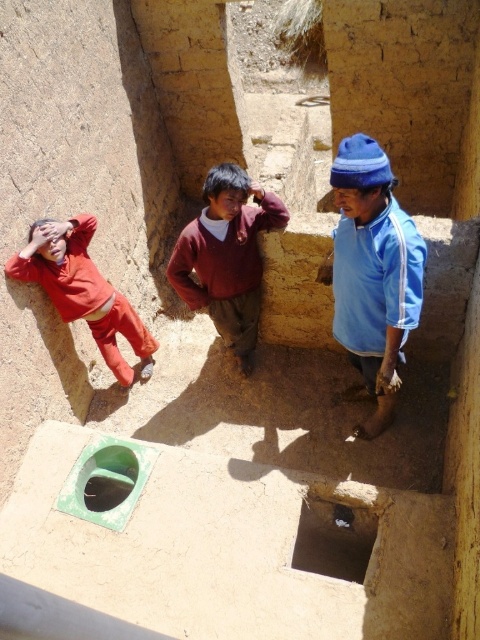
You are standing in a rustic bathroom with three people. You need to determine which of the two items, the maroon sweater at center or the matte red pants at left, is taller. Based on the scene description, which one is taller?

The maroon sweater at center is taller than the matte red pants at left according to the description.

You are standing in a rustic bathroom with two points marked on the floor. The first point is at coordinates point (183, 285) and the second is at point (96, 326). Which point is closer to you as you face the entrance?

Point (183, 285) is in front of point (96, 326), so it is closer to you as you face the entrance.